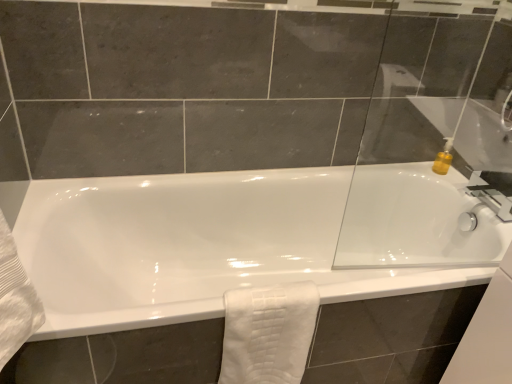
Question: Is the position of white glossy bathtub at center less distant than that of white textured towel at lower center?

Choices:
 (A) yes
 (B) no

Answer: (A)

Question: Is white glossy bathtub at center wider than white textured towel at lower center?

Choices:
 (A) no
 (B) yes

Answer: (B)

Question: Considering the relative sizes of white glossy bathtub at center and white textured towel at lower center in the image provided, is white glossy bathtub at center thinner than white textured towel at lower center?

Choices:
 (A) yes
 (B) no

Answer: (B)

Question: Is white textured towel at lower center inside white glossy bathtub at center?

Choices:
 (A) yes
 (B) no

Answer: (A)

Question: From the image's perspective, is white glossy bathtub at center under white textured towel at lower center?

Choices:
 (A) yes
 (B) no

Answer: (B)

Question: Which is correct: white textured towel at lower center is inside white glossy bathtub at center, or outside of it?

Choices:
 (A) inside
 (B) outside

Answer: (A)

Question: Considering the positions of point (249, 359) and point (92, 206), is point (249, 359) closer or farther from the camera than point (92, 206)?

Choices:
 (A) closer
 (B) farther

Answer: (A)

Question: In the image, is white textured towel at lower center positioned in front of or behind white glossy bathtub at center?

Choices:
 (A) front
 (B) behind

Answer: (B)

Question: From the image's perspective, relative to white glossy bathtub at center, is white textured towel at lower center above or below?

Choices:
 (A) above
 (B) below

Answer: (B)

Question: Considering the positions of point (507, 34) and point (221, 375), is point (507, 34) closer or farther from the camera than point (221, 375)?

Choices:
 (A) farther
 (B) closer

Answer: (A)

Question: In terms of width, does transparent glass door at upper right look wider or thinner when compared to white textured towel at lower center?

Choices:
 (A) thin
 (B) wide

Answer: (A)

Question: From a real-world perspective, relative to white textured towel at lower center, is transparent glass door at upper right vertically above or below?

Choices:
 (A) above
 (B) below

Answer: (A)

Question: In the image, is transparent glass door at upper right on the left side or the right side of white textured towel at lower center?

Choices:
 (A) left
 (B) right

Answer: (B)

Question: In terms of height, does white textured towel at lower center look taller or shorter compared to transparent glass door at upper right?

Choices:
 (A) tall
 (B) short

Answer: (B)

Question: Based on their sizes in the image, would you say white textured towel at lower center is bigger or smaller than transparent glass door at upper right?

Choices:
 (A) small
 (B) big

Answer: (B)